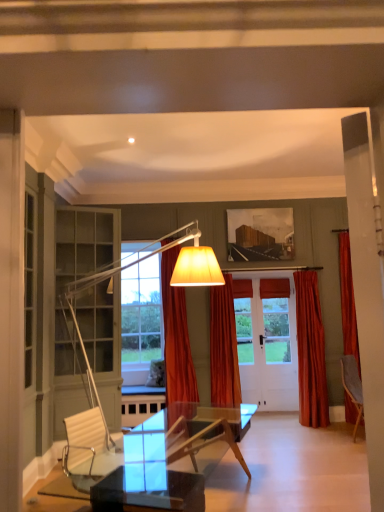
Question: From the image's perspective, is velvet orange curtain at right, the 1th curtain viewed from the right, located above orange velvet curtain at center, which ranks as the second curtain in left-to-right order?

Choices:
 (A) no
 (B) yes

Answer: (A)

Question: Would you say velvet orange curtain at right, the 1th curtain viewed from the right, is outside orange velvet curtain at center, which ranks as the second curtain in left-to-right order?

Choices:
 (A) yes
 (B) no

Answer: (A)

Question: Is the depth of velvet orange curtain at right, the 1th curtain viewed from the right, less than that of orange velvet curtain at center, the second curtain when ordered from right to left?

Choices:
 (A) no
 (B) yes

Answer: (A)

Question: Can you confirm if velvet orange curtain at right, the 1th curtain viewed from the right, is thinner than orange velvet curtain at center, the second curtain when ordered from right to left?

Choices:
 (A) no
 (B) yes

Answer: (B)

Question: Is velvet orange curtain at right, the 3th curtain positioned from the left, placed right next to orange velvet curtain at center, the second curtain when ordered from right to left?

Choices:
 (A) yes
 (B) no

Answer: (B)

Question: From a real-world perspective, relative to orange velvet curtain at center, the second curtain when ordered from right to left, is orange velvet curtain at center, the first curtain from the left, vertically above or below?

Choices:
 (A) below
 (B) above

Answer: (B)

Question: Looking at the image, does orange velvet curtain at center, marked as the third curtain in a right-to-left arrangement, seem bigger or smaller compared to orange velvet curtain at center, the second curtain when ordered from right to left?

Choices:
 (A) small
 (B) big

Answer: (B)

Question: From the image's perspective, relative to orange velvet curtain at center, which ranks as the second curtain in left-to-right order, is orange velvet curtain at center, marked as the third curtain in a right-to-left arrangement, above or below?

Choices:
 (A) below
 (B) above

Answer: (B)

Question: Is orange velvet curtain at center, the first curtain from the left, spatially inside orange velvet curtain at center, the second curtain when ordered from right to left, or outside of it?

Choices:
 (A) outside
 (B) inside

Answer: (A)

Question: Is orange velvet curtain at center, which ranks as the second curtain in left-to-right order, spatially inside orange velvet curtain at center, the first curtain from the left, or outside of it?

Choices:
 (A) outside
 (B) inside

Answer: (A)

Question: In the image, is orange velvet curtain at center, which ranks as the second curtain in left-to-right order, on the left side or the right side of orange velvet curtain at center, the first curtain from the left?

Choices:
 (A) left
 (B) right

Answer: (B)

Question: In the image, is orange velvet curtain at center, which ranks as the second curtain in left-to-right order, positioned in front of or behind orange velvet curtain at center, the first curtain from the left?

Choices:
 (A) front
 (B) behind

Answer: (B)

Question: From the image's perspective, is orange velvet curtain at center, the second curtain when ordered from right to left, positioned above or below orange velvet curtain at center, marked as the third curtain in a right-to-left arrangement?

Choices:
 (A) above
 (B) below

Answer: (B)

Question: Is point (322, 373) positioned closer to the camera than point (180, 343)?

Choices:
 (A) farther
 (B) closer

Answer: (A)

Question: Looking at their shapes, would you say velvet orange curtain at right, the 1th curtain viewed from the right, is wider or thinner than orange velvet curtain at center, the first curtain from the left?

Choices:
 (A) thin
 (B) wide

Answer: (A)